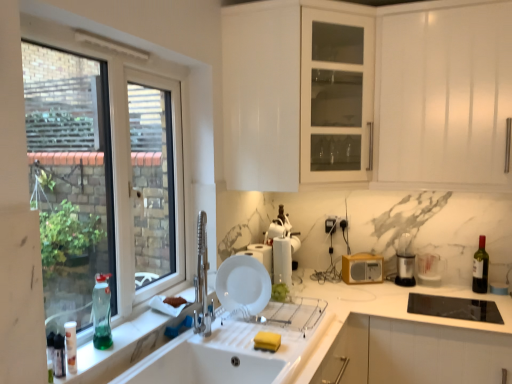
Question: Is green glass bottle at window, which ranks as the second bottle in front-to-back order, taller or shorter than black plastic trash can at right, the 5th appliance when ordered from left to right?

Choices:
 (A) short
 (B) tall

Answer: (B)

Question: From the image's perspective, is green glass bottle at window, which ranks as the second bottle in front-to-back order, positioned above or below black plastic trash can at right, the 5th appliance when ordered from left to right?

Choices:
 (A) above
 (B) below

Answer: (A)

Question: Based on their relative distances, which object is farther from the yellow plastic radio at right, marked as the 4th appliance in a left-to-right arrangement?

Choices:
 (A) white ceramic sink at lower center
 (B) black plastic trash can at right, marked as the 1th appliance in a right-to-left arrangement
 (C) white plastic bottle at lower left, which ranks as the third bottle in back-to-front order
 (D) white plastic container at upper center, the 1th appliance viewed from the left
 (E) white marble countertop at sink

Answer: (C)

Question: Which object is the farthest from the dark glass bottle at right, which is the third bottle from left to right?

Choices:
 (A) white plastic container at upper center, the 1th appliance viewed from the left
 (B) white plastic paper towel holder at center, the third appliance in the left-to-right sequence
 (C) black plastic trash can at right, marked as the 1th appliance in a right-to-left arrangement
 (D) white ceramic sink at lower center
 (E) white matte plate at sink

Answer: (D)